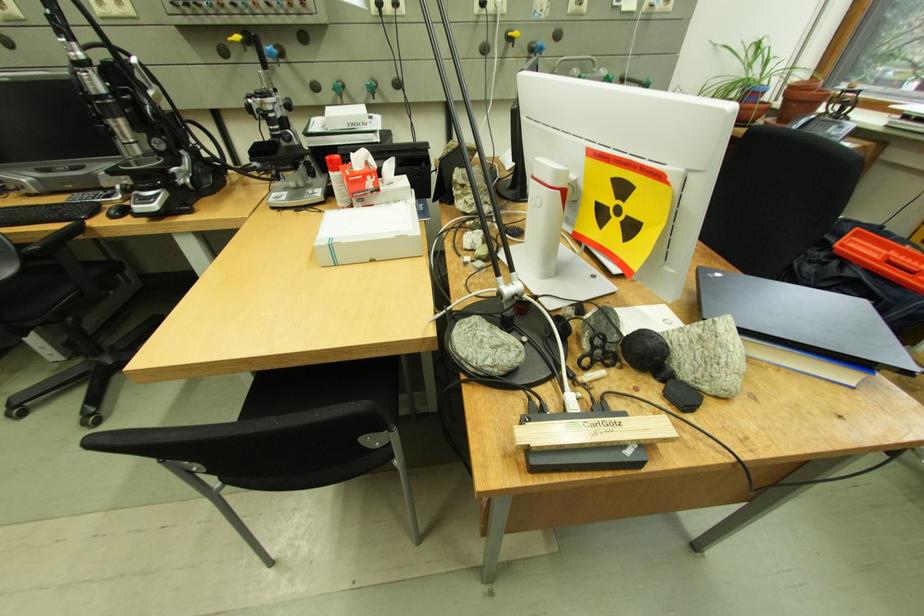
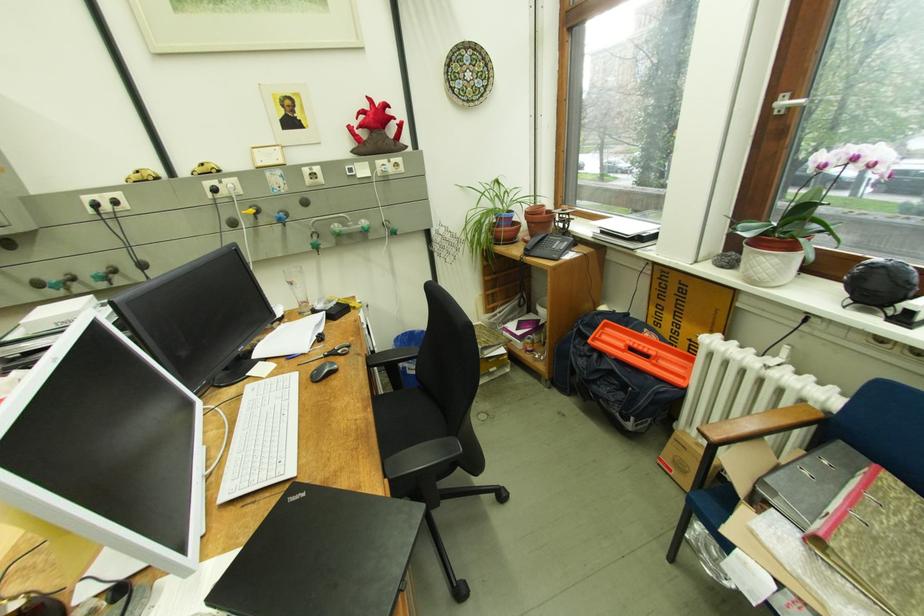
In the second image, find the point that corresponds to (824,123) in the first image.

(555, 240)